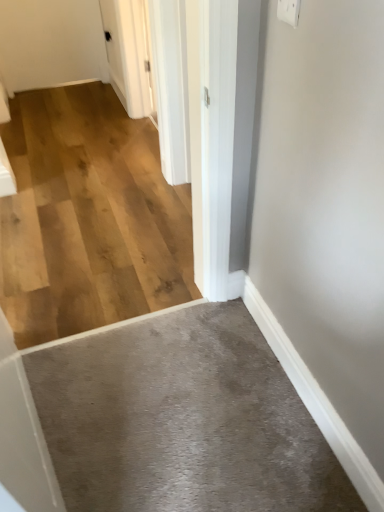
Question: Can white glossy door at upper center be found inside gray carpet at lower center, which appears as the 1th concrete when ordered from the bottom?

Choices:
 (A) no
 (B) yes

Answer: (A)

Question: Does gray carpet at lower center, the first concrete when ordered from front to back, lie behind white glossy door at upper center?

Choices:
 (A) no
 (B) yes

Answer: (A)

Question: From the image's perspective, would you say gray carpet at lower center, the second concrete when ordered from top to bottom, is positioned over white glossy door at upper center?

Choices:
 (A) no
 (B) yes

Answer: (A)

Question: Is gray carpet at lower center, the second concrete when ordered from top to bottom, wider than white glossy door at upper center?

Choices:
 (A) no
 (B) yes

Answer: (B)

Question: Is gray carpet at lower center, the second concrete when ordered from top to bottom, thinner than white glossy door at upper center?

Choices:
 (A) no
 (B) yes

Answer: (A)

Question: Considering the relative positions of white plastic electric outlet at upper right and white glossy door at upper center in the image provided, is white plastic electric outlet at upper right to the left or to the right of white glossy door at upper center?

Choices:
 (A) right
 (B) left

Answer: (A)

Question: From the image's perspective, is white plastic electric outlet at upper right above or below white glossy door at upper center?

Choices:
 (A) below
 (B) above

Answer: (A)

Question: From a real-world perspective, relative to white glossy door at upper center, is white plastic electric outlet at upper right vertically above or below?

Choices:
 (A) above
 (B) below

Answer: (A)

Question: Based on their sizes in the image, would you say white plastic electric outlet at upper right is bigger or smaller than white glossy door at upper center?

Choices:
 (A) small
 (B) big

Answer: (A)

Question: Looking at the image, does natural wood flooring at center, the 2th concrete in the bottom-to-top sequence, seem bigger or smaller compared to white plastic electric outlet at upper right?

Choices:
 (A) small
 (B) big

Answer: (B)

Question: Do you think natural wood flooring at center, which is counted as the first concrete, starting from the top, is within white plastic electric outlet at upper right, or outside of it?

Choices:
 (A) inside
 (B) outside

Answer: (B)

Question: Is natural wood flooring at center, the 2th concrete in the bottom-to-top sequence, wider or thinner than white plastic electric outlet at upper right?

Choices:
 (A) thin
 (B) wide

Answer: (B)

Question: Does point (130, 135) appear closer or farther from the camera than point (286, 7)?

Choices:
 (A) farther
 (B) closer

Answer: (A)

Question: Considering the positions of gray carpet at lower center, the second concrete when ordered from top to bottom, and natural wood flooring at center, the first concrete from the back, in the image, is gray carpet at lower center, the second concrete when ordered from top to bottom, taller or shorter than natural wood flooring at center, the first concrete from the back,?

Choices:
 (A) tall
 (B) short

Answer: (A)

Question: From the image's perspective, is gray carpet at lower center, the second concrete when ordered from top to bottom, positioned above or below natural wood flooring at center, positioned as the 2th concrete in front-to-back order?

Choices:
 (A) below
 (B) above

Answer: (A)